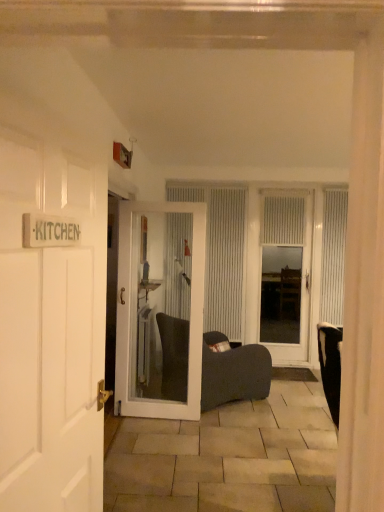
Question: Is white glossy door at center, the 2th door in the back-to-front sequence, bigger or smaller than white textured curtain at center, placed as the third curtain when sorted from right to left?

Choices:
 (A) big
 (B) small

Answer: (A)

Question: Considering the positions of point (175, 204) and point (228, 261), is point (175, 204) closer or farther from the camera than point (228, 261)?

Choices:
 (A) closer
 (B) farther

Answer: (A)

Question: Which of these objects is positioned closest to the white wooden door at left, the 1th door in the front-to-back sequence?

Choices:
 (A) dark fabric chair at center
 (B) white glass door at center, which is the 1th door in right-to-left order
 (C) white textured curtain at center, which is the 2th curtain in left-to-right order
 (D) white glossy door at center, placed as the second door when sorted from left to right
 (E) white textured curtain at right, the third curtain viewed from the left

Answer: (D)

Question: Based on their relative distances, which object is nearer to the white textured curtain at right, placed as the first curtain when sorted from right to left?

Choices:
 (A) white textured curtain at center, which ranks as the second curtain in right-to-left order
 (B) dark fabric chair at center
 (C) white textured curtain at center, placed as the third curtain when sorted from right to left
 (D) white glass door at center, the third door when ordered from front to back
 (E) white glossy door at center, placed as the second door when sorted from left to right

Answer: (D)